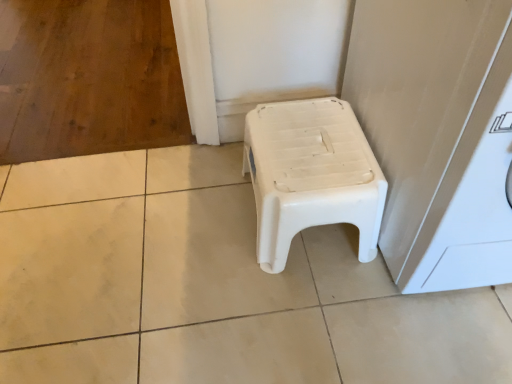
At what (x,y) coordinates should I click in order to perform the action: click on vacant space in front of white plastic stool at center. Please return your answer as a coordinate pair (x, y). This screenshot has height=384, width=512. Looking at the image, I should click on (314, 319).